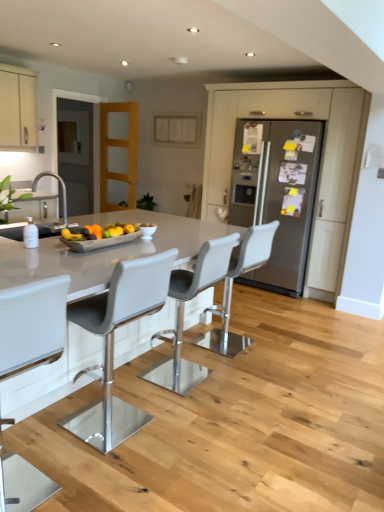
The image size is (384, 512). Identify the location of free space underneath white leather bar stool at center, placed as the third chair when sorted from back to front (from a real-world perspective). (124, 428).